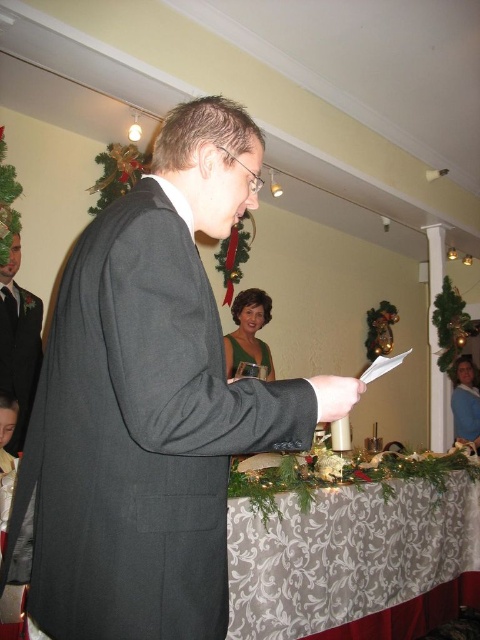
Question: Considering the real-world distances, which object is farthest from the dark gray suit at center?

Choices:
 (A) matte black suit at center
 (B) green satin dress at center

Answer: (B)

Question: Is matte black suit at center bigger than green satin dress at center?

Choices:
 (A) yes
 (B) no

Answer: (A)

Question: Among these objects, which one is farthest from the camera?

Choices:
 (A) green velvet dress at center
 (B) green satin dress at center
 (C) matte black suit at center
 (D) white damask tablecloth at lower center

Answer: (A)

Question: Can you confirm if dark gray suit at center is positioned to the left of green satin dress at center?

Choices:
 (A) yes
 (B) no

Answer: (A)

Question: Which point is closer to the camera taking this photo?

Choices:
 (A) (467, 394)
 (B) (22, 442)

Answer: (B)

Question: Does white damask tablecloth at lower center appear under green satin dress at center?

Choices:
 (A) yes
 (B) no

Answer: (A)